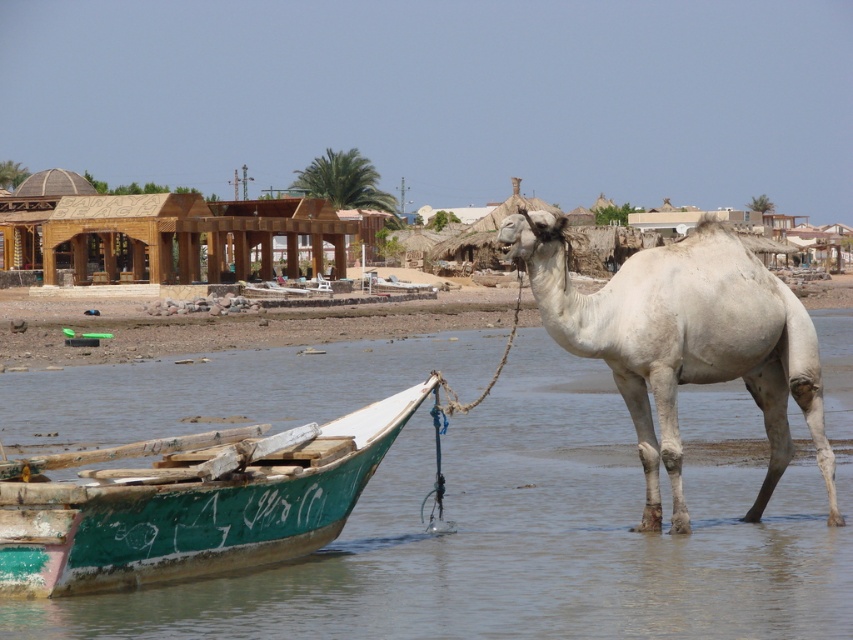
You are a photographer positioned at the edge of the water. You want to capture a photo of the white matte camel at center and the green painted wood boat at lower left in the same frame. Which object should you position closer to the left side of your camera viewfinder to include both in the shot?

The green painted wood boat at lower left is to the left of the white matte camel at center, so you should position the green painted wood boat at lower left closer to the left side of your camera viewfinder to include both in the shot.

You are a fisherman who wants to wade through the clear water at boat right to reach the green painted wood boat at lower left. Which direction should you move towards?

The clear water at boat right is positioned on the right side of the green painted wood boat at lower left, so you should move towards the left to reach the boat.